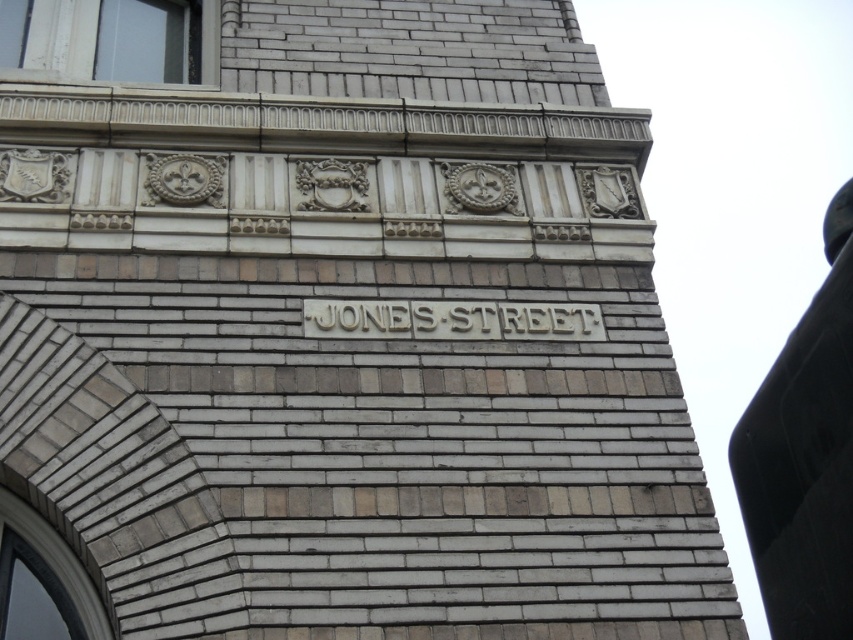
Question: Can you confirm if black glossy sign at upper center is wider than carved stone jones street sign at center?

Choices:
 (A) yes
 (B) no

Answer: (A)

Question: Where is black glossy sign at upper center located in relation to carved stone jones street sign at center in the image?

Choices:
 (A) right
 (B) left

Answer: (A)

Question: Which object is farther from the camera taking this photo?

Choices:
 (A) black glossy sign at upper center
 (B) carved stone jones street sign at center

Answer: (B)

Question: Can you confirm if black glossy sign at upper center is bigger than carved stone jones street sign at center?

Choices:
 (A) no
 (B) yes

Answer: (B)

Question: Among these objects, which one is farthest from the camera?

Choices:
 (A) black glossy sign at upper center
 (B) carved stone jones street sign at center

Answer: (B)

Question: Which of the following is the farthest from the observer?

Choices:
 (A) (764, 396)
 (B) (599, 339)

Answer: (A)